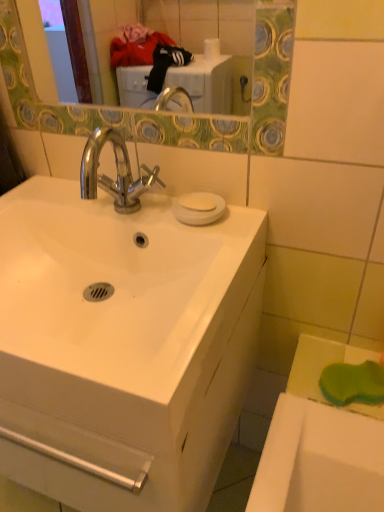
Locate an element on the screen. The height and width of the screenshot is (512, 384). vacant space in front of white matte soap at upper center is located at coordinates (215, 233).